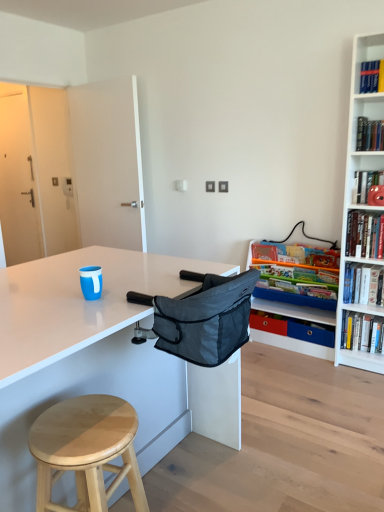
Question: Is the position of dark gray fabric folding chair at center less distant than that of matte plastic shelf at right?

Choices:
 (A) no
 (B) yes

Answer: (B)

Question: Can you confirm if dark gray fabric folding chair at center is thinner than matte plastic shelf at right?

Choices:
 (A) yes
 (B) no

Answer: (B)

Question: Would you say dark gray fabric folding chair at center is outside matte plastic shelf at right?

Choices:
 (A) yes
 (B) no

Answer: (A)

Question: Is dark gray fabric folding chair at center smaller than matte plastic shelf at right?

Choices:
 (A) no
 (B) yes

Answer: (B)

Question: Does dark gray fabric folding chair at center lie behind matte plastic shelf at right?

Choices:
 (A) yes
 (B) no

Answer: (B)

Question: In terms of height, does dark gray fabric folding chair at center look taller or shorter compared to hardcover book at upper right, marked as the fourth book in a top-to-bottom arrangement?

Choices:
 (A) tall
 (B) short

Answer: (A)

Question: Considering their positions, is dark gray fabric folding chair at center located in front of or behind hardcover book at upper right, positioned as the first book in bottom-to-top order?

Choices:
 (A) behind
 (B) front

Answer: (B)

Question: From the image's perspective, relative to hardcover book at upper right, marked as the fourth book in a top-to-bottom arrangement, is dark gray fabric folding chair at center above or below?

Choices:
 (A) below
 (B) above

Answer: (B)

Question: Is dark gray fabric folding chair at center inside or outside of hardcover book at upper right, marked as the fourth book in a top-to-bottom arrangement?

Choices:
 (A) inside
 (B) outside

Answer: (B)

Question: In the image, is light wood stool at lower left on the left side or the right side of hardcover book at upper right, which is the third book from top to bottom?

Choices:
 (A) left
 (B) right

Answer: (A)

Question: Relative to hardcover book at upper right, which is the third book from top to bottom, is light wood stool at lower left in front or behind?

Choices:
 (A) behind
 (B) front

Answer: (B)

Question: In terms of size, does light wood stool at lower left appear bigger or smaller than hardcover book at upper right, the second book when ordered from bottom to top?

Choices:
 (A) small
 (B) big

Answer: (B)

Question: From a real-world perspective, is light wood stool at lower left positioned above or below hardcover book at upper right, which is the third book from top to bottom?

Choices:
 (A) below
 (B) above

Answer: (A)

Question: Based on their sizes in the image, would you say light wood stool at lower left is bigger or smaller than hardcover book at upper right, positioned as the first book in bottom-to-top order?

Choices:
 (A) small
 (B) big

Answer: (B)

Question: Is light wood stool at lower left spatially inside hardcover book at upper right, positioned as the first book in bottom-to-top order, or outside of it?

Choices:
 (A) inside
 (B) outside

Answer: (B)